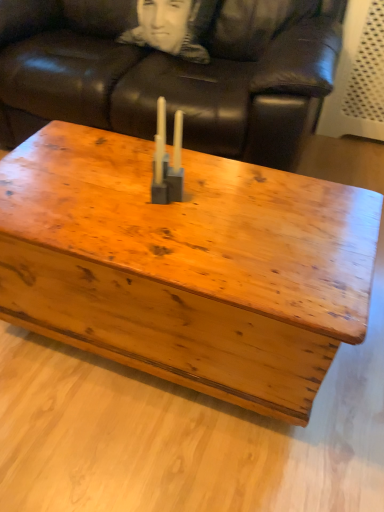
The image size is (384, 512). What do you see at coordinates (186, 266) in the screenshot?
I see `wooden coffee table at center` at bounding box center [186, 266].

What do you see at coordinates (172, 74) in the screenshot? Image resolution: width=384 pixels, height=512 pixels. I see `brown leather couch at upper center` at bounding box center [172, 74].

Where is `wooden coffee table at center`? The image size is (384, 512). wooden coffee table at center is located at coordinates (186, 266).

From the image's perspective, is brown leather couch at upper center above black fabric pillow at upper center?

No, from the image's perspective, brown leather couch at upper center is not on top of black fabric pillow at upper center.

Can you confirm if brown leather couch at upper center is shorter than black fabric pillow at upper center?

Incorrect, the height of brown leather couch at upper center does not fall short of that of black fabric pillow at upper center.

Is brown leather couch at upper center beside black fabric pillow at upper center?

They are not placed beside each other.

Is brown leather couch at upper center facing towards black fabric pillow at upper center?

Yes.

Which of these two, black fabric pillow at upper center or wooden coffee table at center, is wider?

wooden coffee table at center.

From a real-world perspective, relative to wooden coffee table at center, is black fabric pillow at upper center vertically above or below?

In terms of real-world spatial position, black fabric pillow at upper center is above wooden coffee table at center.

Could you tell me if black fabric pillow at upper center is turned towards wooden coffee table at center?

Yes, black fabric pillow at upper center faces towards wooden coffee table at center.

Is black fabric pillow at upper center beside wooden coffee table at center?

black fabric pillow at upper center is not next to wooden coffee table at center, and they're not touching.

From the picture: Is wooden coffee table at center to the right of matte gray plastic candle holder at center from the viewer's perspective?

Incorrect, wooden coffee table at center is not on the right side of matte gray plastic candle holder at center.

Is wooden coffee table at center further to the viewer compared to matte gray plastic candle holder at center?

No, it is not.

Is point (244, 354) positioned before point (157, 198)?

Yes, point (244, 354) is in front of point (157, 198).

Which of these two, wooden coffee table at center or matte gray plastic candle holder at center, stands shorter?

matte gray plastic candle holder at center.

From a real-world perspective, which object stands above the other?

brown leather couch at upper center.

Which is behind, point (293, 9) or point (191, 281)?

The point (293, 9) is behind.

Would you say brown leather couch at upper center is inside or outside wooden coffee table at center?

brown leather couch at upper center cannot be found inside wooden coffee table at center.

Is brown leather couch at upper center oriented away from wooden coffee table at center?

brown leather couch at upper center is not turned away from wooden coffee table at center.

Is matte gray plastic candle holder at center not within black fabric pillow at upper center?

Yes, matte gray plastic candle holder at center is not within black fabric pillow at upper center.

Does matte gray plastic candle holder at center have a greater width compared to black fabric pillow at upper center?

No.

From the picture: Are matte gray plastic candle holder at center and black fabric pillow at upper center located far from each other?

They are positioned close to each other.

What's the angular difference between matte gray plastic candle holder at center and black fabric pillow at upper center's facing directions?

The facing directions of matte gray plastic candle holder at center and black fabric pillow at upper center are 7.31 degrees apart.

Is brown leather couch at upper center with matte gray plastic candle holder at center?

They are not placed beside each other.

Does brown leather couch at upper center have a greater height compared to matte gray plastic candle holder at center?

Yes, brown leather couch at upper center is taller than matte gray plastic candle holder at center.

Is matte gray plastic candle holder at center a part of brown leather couch at upper center?

No, matte gray plastic candle holder at center is not surrounded by brown leather couch at upper center.

Which of these two, brown leather couch at upper center or matte gray plastic candle holder at center, is wider?

brown leather couch at upper center is wider.

Is matte gray plastic candle holder at center wider or thinner than wooden coffee table at center?

Considering their sizes, matte gray plastic candle holder at center looks slimmer than wooden coffee table at center.

Considering the points (156, 149) and (160, 260), which point is behind, point (156, 149) or point (160, 260)?

The point (156, 149) is more distant.

Where is `studio couch that appears below the black fabric pillow at upper center (from a real-world perspective)`? The height and width of the screenshot is (512, 384). studio couch that appears below the black fabric pillow at upper center (from a real-world perspective) is located at coordinates (172, 74).

The image size is (384, 512). I want to click on person located on the left of wooden coffee table at center, so click(172, 27).

Based on the photo, which object lies further to the anchor point matte gray plastic candle holder at center, black fabric pillow at upper center or brown leather couch at upper center?

black fabric pillow at upper center lies further to matte gray plastic candle holder at center than the other object.

Which object lies further to the anchor point black fabric pillow at upper center, matte gray plastic candle holder at center or brown leather couch at upper center?

matte gray plastic candle holder at center is positioned further to the anchor black fabric pillow at upper center.

Considering their positions, is brown leather couch at upper center positioned closer to wooden coffee table at center than matte gray plastic candle holder at center?

The object closer to wooden coffee table at center is matte gray plastic candle holder at center.

In the scene shown: Which object lies further to the anchor point brown leather couch at upper center, wooden coffee table at center or black fabric pillow at upper center?

wooden coffee table at center.

From the image, which object appears to be farther from black fabric pillow at upper center, brown leather couch at upper center or wooden coffee table at center?

wooden coffee table at center lies further to black fabric pillow at upper center than the other object.

Consider the image. Which object lies nearer to the anchor point black fabric pillow at upper center, wooden coffee table at center or brown leather couch at upper center?

Based on the image, brown leather couch at upper center appears to be nearer to black fabric pillow at upper center.

Considering their positions, is black fabric pillow at upper center positioned further to brown leather couch at upper center than wooden coffee table at center?

wooden coffee table at center.

Which object lies nearer to the anchor point black fabric pillow at upper center, wooden coffee table at center or matte gray plastic candle holder at center?

The object closer to black fabric pillow at upper center is matte gray plastic candle holder at center.

This screenshot has width=384, height=512. I want to click on studio couch that lies between black fabric pillow at upper center and matte gray plastic candle holder at center from top to bottom, so click(172, 74).

I want to click on candle holder between black fabric pillow at upper center and wooden coffee table at center vertically, so click(x=167, y=160).

Where is `candle holder between brown leather couch at upper center and wooden coffee table at center from top to bottom`? The width and height of the screenshot is (384, 512). candle holder between brown leather couch at upper center and wooden coffee table at center from top to bottom is located at coordinates (167, 160).

Where is `studio couch between black fabric pillow at upper center and wooden coffee table at center from top to bottom`? Image resolution: width=384 pixels, height=512 pixels. studio couch between black fabric pillow at upper center and wooden coffee table at center from top to bottom is located at coordinates (172, 74).